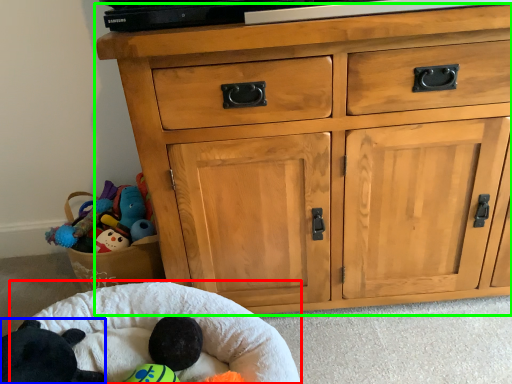
Question: Considering the real-world distances, which object is farthest from infant bed (highlighted by a red box)? animal (highlighted by a blue box) or chest of drawers (highlighted by a green box)?

Choices:
 (A) animal
 (B) chest of drawers

Answer: (B)